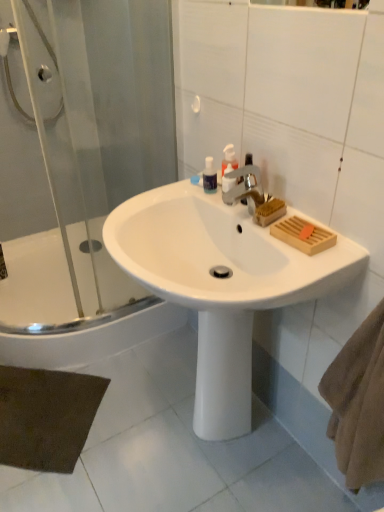
Locate an element on the screen. This screenshot has width=384, height=512. vacant space underneath white glossy sink at center (from a real-world perspective) is located at coordinates (196, 439).